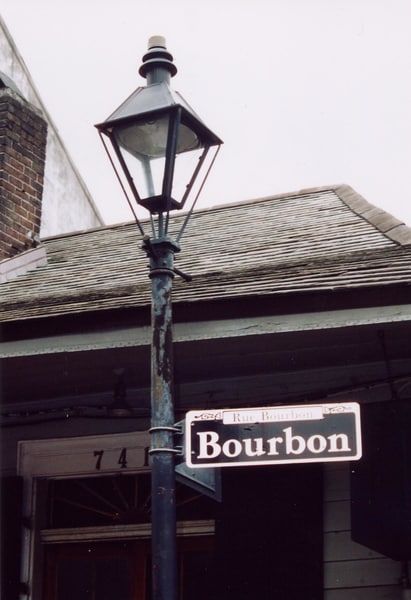
Where is `window`? Image resolution: width=411 pixels, height=600 pixels. window is located at coordinates (403, 479).